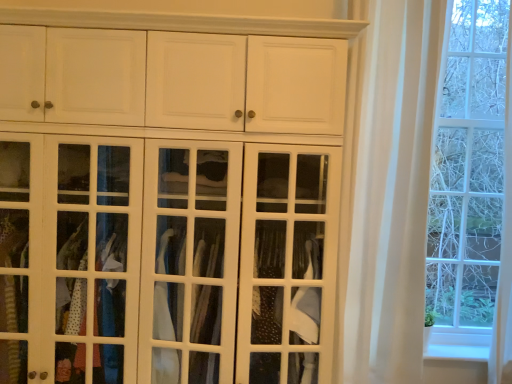
Question: From the image's perspective, relative to white glass cabinet at center, is white sheer curtain at right above or below?

Choices:
 (A) below
 (B) above

Answer: (B)

Question: Considering the positions of white sheer curtain at right and white glass cabinet at center in the image, is white sheer curtain at right wider or thinner than white glass cabinet at center?

Choices:
 (A) thin
 (B) wide

Answer: (A)

Question: Is point (418, 92) closer or farther from the camera than point (154, 170)?

Choices:
 (A) closer
 (B) farther

Answer: (B)

Question: Considering their positions, is white glass cabinet at center located in front of or behind white sheer curtain at right?

Choices:
 (A) front
 (B) behind

Answer: (A)

Question: Looking at their shapes, would you say white glass cabinet at center is wider or thinner than white sheer curtain at right?

Choices:
 (A) thin
 (B) wide

Answer: (B)

Question: From a real-world perspective, relative to white sheer curtain at right, is white glass cabinet at center vertically above or below?

Choices:
 (A) below
 (B) above

Answer: (A)

Question: From the image's perspective, is white glass cabinet at center located above or below white sheer curtain at right?

Choices:
 (A) above
 (B) below

Answer: (B)